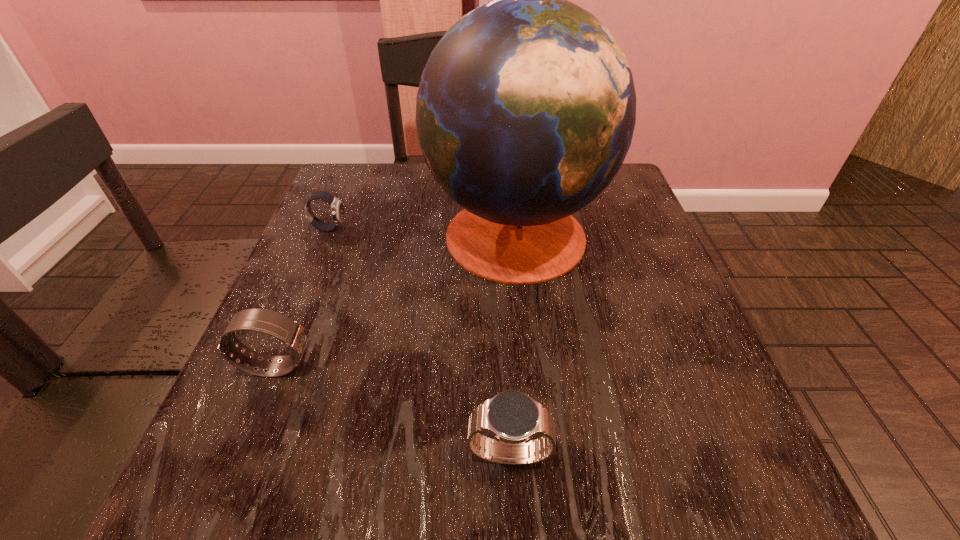
This screenshot has height=540, width=960. What are the coordinates of `vacant space positioned on the back of the rightmost watch` in the screenshot? It's located at (499, 256).

Find the location of a particular element. The height and width of the screenshot is (540, 960). free space located on the face of the shortest object is located at coordinates (419, 228).

The image size is (960, 540). I want to click on object that is positioned at the far edge, so click(x=526, y=108).

I want to click on object located at the near edge, so tap(512, 417).

Locate an element on the screen. object present at the right edge is located at coordinates (526, 108).

Locate an element on the screen. The image size is (960, 540). object located at the far right corner is located at coordinates (526, 108).

Find the location of a particular element. The image size is (960, 540). vacant space at the far edge of the desktop is located at coordinates (400, 178).

Image resolution: width=960 pixels, height=540 pixels. In the image, there is a desktop. In order to click on vacant space at the near edge in this screenshot , I will do `click(369, 468)`.

Locate an element on the screen. The width and height of the screenshot is (960, 540). vacant space at the left edge of the desktop is located at coordinates (322, 268).

In the image, there is a desktop. What are the coordinates of `vacant space at the right edge` in the screenshot? It's located at (666, 316).